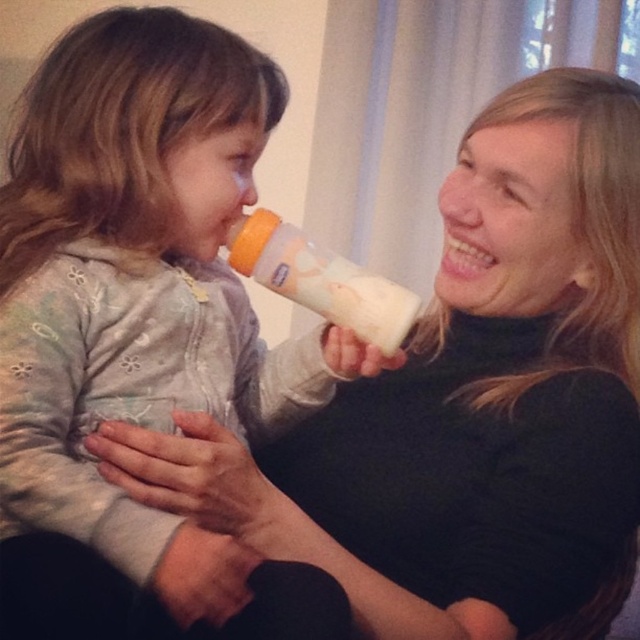
You are a parent holding a white soft baby bottle at center. You want to hand it to your child who is sitting on a highchair 60 centimeters away. Can you reach the child without moving closer?

The white soft baby bottle at center is 51.33 centimeters away from viewer, so yes, you can reach the child who is 60 centimeters away because the distance is within your arm length.

You are a parent trying to choose between two baby bottles for your child. You notice in the image that there are a white soft baby bottle at center and a white matte bottle at center. Based on their positions in the scene, which one is closer to the child?

The white soft baby bottle at center is closer to the child because it is in front of the white matte bottle at center.